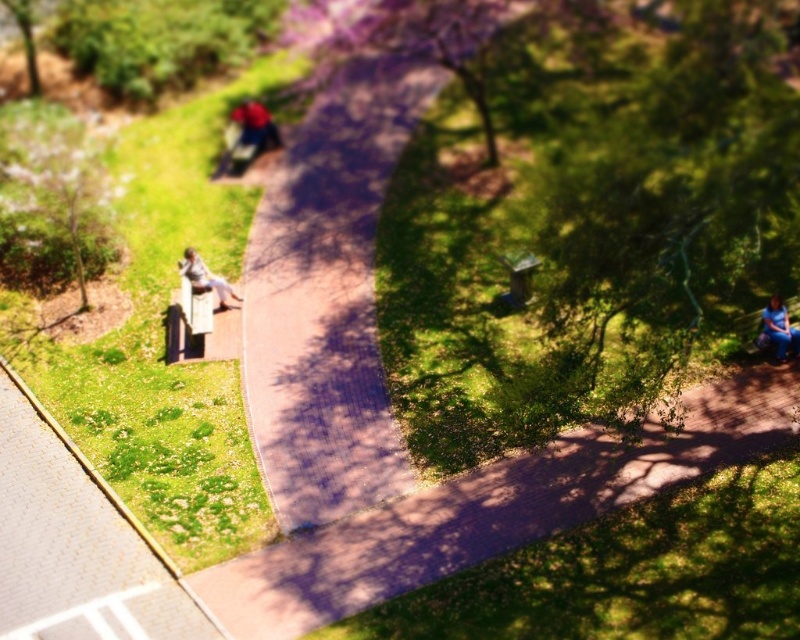
You are planning to walk along the purple brick path at center and the paved brick path at center in the park scene. Since both paths are in the center, which path should you choose if you want to walk on the narrower one?

The purple brick path at center has a lesser width compared to the paved brick path at center, so you should choose the purple brick path at center if you want to walk on the narrower one.

You are a delivery robot with a width of 1.2 meters. You need to travel along the purple brick path at center and the paved brick path at center to reach the delivery point. Can you safely navigate through the space between them?

The purple brick path at center and the paved brick path at center are 5.12 meters apart from each other. Since the robot is 1.2 meters wide, there is sufficient space between the two paths to navigate safely.

You are standing at the point labeled point (x=29, y=408) and want to walk to the point labeled point (x=400, y=532). Based on the park layout described, will you have to walk towards the tree or away from it?

Since point (x=400, y=532) is in front of point (x=29, y=408), you will be walking towards the tree as the path curves gently through the park shaded by the large tree.